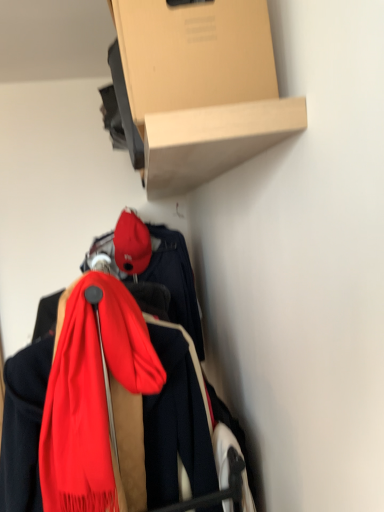
Question: Is silky red scarf at center at the back of matte red cap at center?

Choices:
 (A) no
 (B) yes

Answer: (A)

Question: From the image's perspective, is matte red cap at center located above silky red scarf at center?

Choices:
 (A) no
 (B) yes

Answer: (B)

Question: Is matte red cap at center aimed at silky red scarf at center?

Choices:
 (A) yes
 (B) no

Answer: (B)

Question: Considering the relative sizes of matte red cap at center and silky red scarf at center in the image provided, is matte red cap at center taller than silky red scarf at center?

Choices:
 (A) yes
 (B) no

Answer: (B)

Question: Can you confirm if matte red cap at center is positioned to the left of silky red scarf at center?

Choices:
 (A) yes
 (B) no

Answer: (A)

Question: Is matte red cap at center shorter than silky red scarf at center?

Choices:
 (A) no
 (B) yes

Answer: (B)

Question: Considering the relative positions of silky red scarf at center and matte red cap at center in the image provided, is silky red scarf at center to the left of matte red cap at center from the viewer's perspective?

Choices:
 (A) yes
 (B) no

Answer: (B)

Question: From a real-world perspective, is silky red scarf at center located beneath matte red cap at center?

Choices:
 (A) no
 (B) yes

Answer: (B)

Question: Could matte red cap at center be considered to be inside silky red scarf at center?

Choices:
 (A) no
 (B) yes

Answer: (A)

Question: Is silky red scarf at center outside of matte red cap at center?

Choices:
 (A) yes
 (B) no

Answer: (A)

Question: Does silky red scarf at center have a greater height compared to matte red cap at center?

Choices:
 (A) yes
 (B) no

Answer: (A)

Question: From the image's perspective, would you say silky red scarf at center is shown under matte red cap at center?

Choices:
 (A) yes
 (B) no

Answer: (A)

Question: Considering the relative sizes of cardboard box at upper center and matte red cap at center in the image provided, is cardboard box at upper center shorter than matte red cap at center?

Choices:
 (A) yes
 (B) no

Answer: (B)